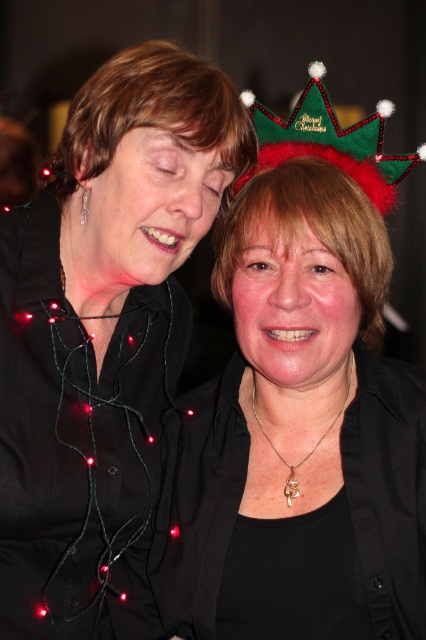
Where is the matte black shirt at upper left located in the image?

The matte black shirt at upper left is located at the 2D coordinates point (103, 337).

In the scene shown: You are standing in front of the image and want to know how far the point at coordinates (354, 218) is from you. Can you determine the distance?

The point at coordinates (354, 218) is 3.47 feet from the viewer.

You are standing at point (367, 244) and want to walk to the exit located at point (400, 538). Considering the festive scene described, is there any obstacle between your current position and the exit that you should be aware of?

Point (400, 538) is in front of point (367, 244), so there is no obstacle between them. You can proceed safely to the exit at point (400, 538).